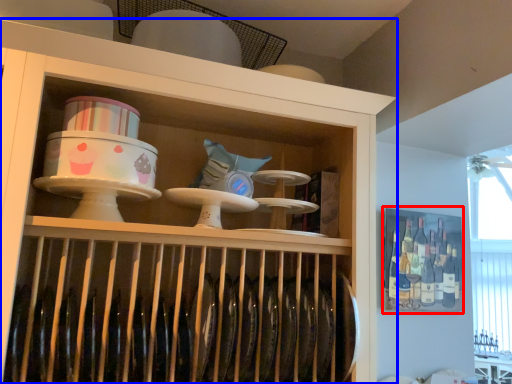
Question: Which of the following is the farthest to the observer, cabinet (highlighted by a red box) or shelf (highlighted by a blue box)?

Choices:
 (A) cabinet
 (B) shelf

Answer: (A)